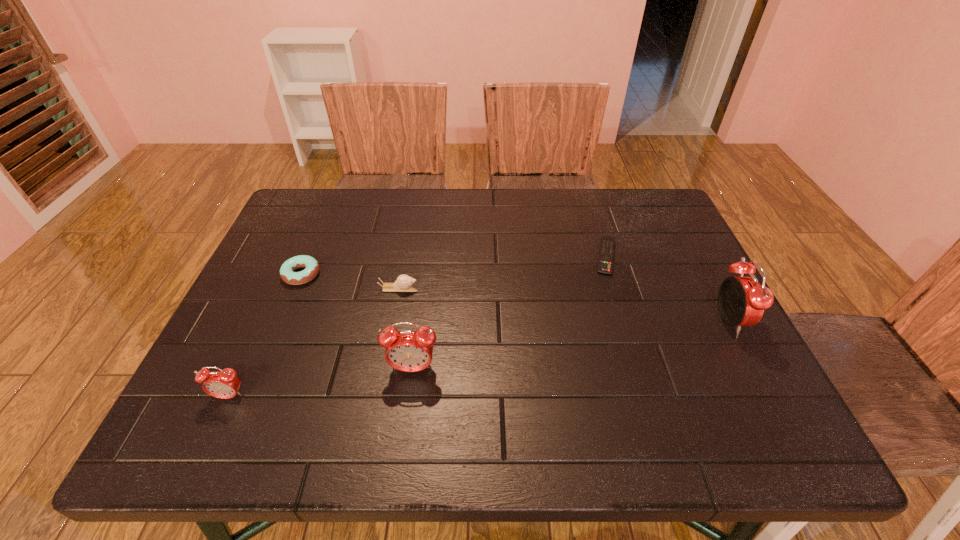
This screenshot has height=540, width=960. Identify the location of vacant space at the far left corner. 334,227.

The image size is (960, 540). In the image, there is a desktop. What are the coordinates of `vacant area at the near right corner` in the screenshot? It's located at (753, 375).

Find the location of a particular element. This screenshot has width=960, height=540. empty space between the second shortest object and the second nearest alarm clock is located at coordinates (357, 322).

Locate an element on the screen. vacant area that lies between the fifth tallest object and the third tallest object is located at coordinates (266, 335).

Find the location of a particular element. This screenshot has height=540, width=960. free space between the escargot and the doughnut is located at coordinates (350, 281).

Locate an element on the screen. The height and width of the screenshot is (540, 960). unoccupied area between the escargot and the doughnut is located at coordinates (350, 281).

Image resolution: width=960 pixels, height=540 pixels. Identify the location of free space between the shortest alarm clock and the second shortest object. (266, 335).

Find the location of a particular element. unoccupied position between the fifth tallest object and the escargot is located at coordinates (350, 281).

You are a GUI agent. You are given a task and a screenshot of the screen. Output one action in this format:
    pyautogui.click(x=<x>, y=<y>)
    Task: Click on the vacant area that lies between the shortest object and the fifth shortest object
    This screenshot has height=540, width=960.
    Given the screenshot: What is the action you would take?
    pyautogui.click(x=510, y=313)

The width and height of the screenshot is (960, 540). I want to click on free space between the fifth tallest object and the leftmost alarm clock, so click(x=266, y=335).